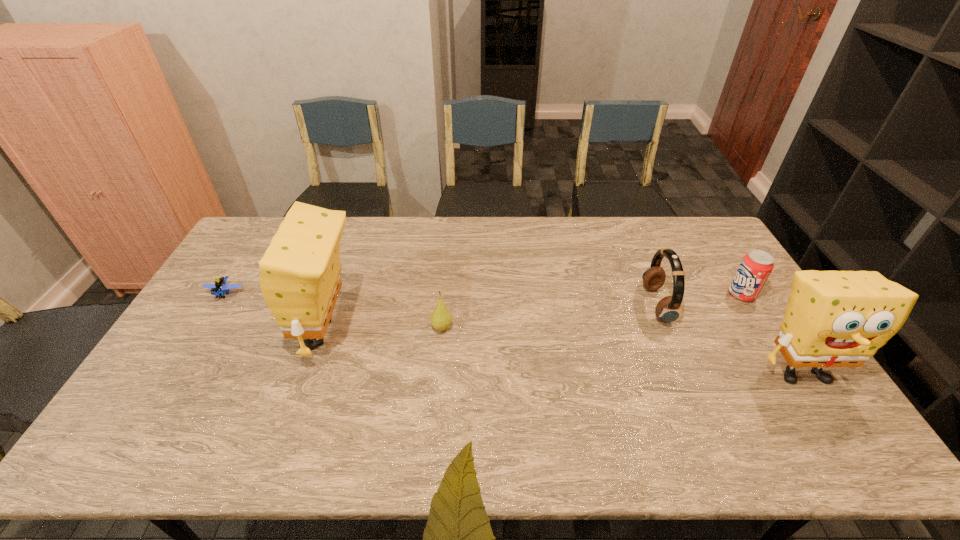
I want to click on vacant space at the right edge of the desktop, so click(x=732, y=259).

Locate an element on the screen. free space between the Lego and the fifth tallest object is located at coordinates [x=334, y=311].

I want to click on vacant space in between the soda can and the shorter sponge, so click(x=772, y=333).

Locate an element on the screen. Image resolution: width=960 pixels, height=540 pixels. unoccupied area between the soda can and the leftmost object is located at coordinates [484, 294].

Locate an element on the screen. The image size is (960, 540). vacant area that lies between the fourth object from right to left and the headset is located at coordinates (549, 316).

This screenshot has width=960, height=540. In order to click on vacant space that is in between the tallest object and the headset in this screenshot , I will do `click(491, 319)`.

Find the location of a particular element. This screenshot has width=960, height=540. free spot between the third object from left to right and the right sponge is located at coordinates (622, 350).

I want to click on empty space that is in between the right sponge and the soda can, so click(x=772, y=333).

Find the location of a particular element. This screenshot has height=540, width=960. empty space between the third object from left to right and the fifth object from right to left is located at coordinates (383, 330).

The image size is (960, 540). In order to click on vacant area that lies between the fourth shortest object and the second shortest object in this screenshot , I will do `click(549, 316)`.